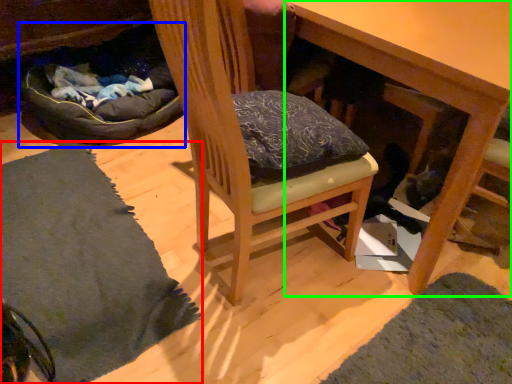
Question: Which object is positioned farthest from mat (highlighted by a red box)? Select from bean bag chair (highlighted by a blue box) and table (highlighted by a green box).

Choices:
 (A) bean bag chair
 (B) table

Answer: (B)